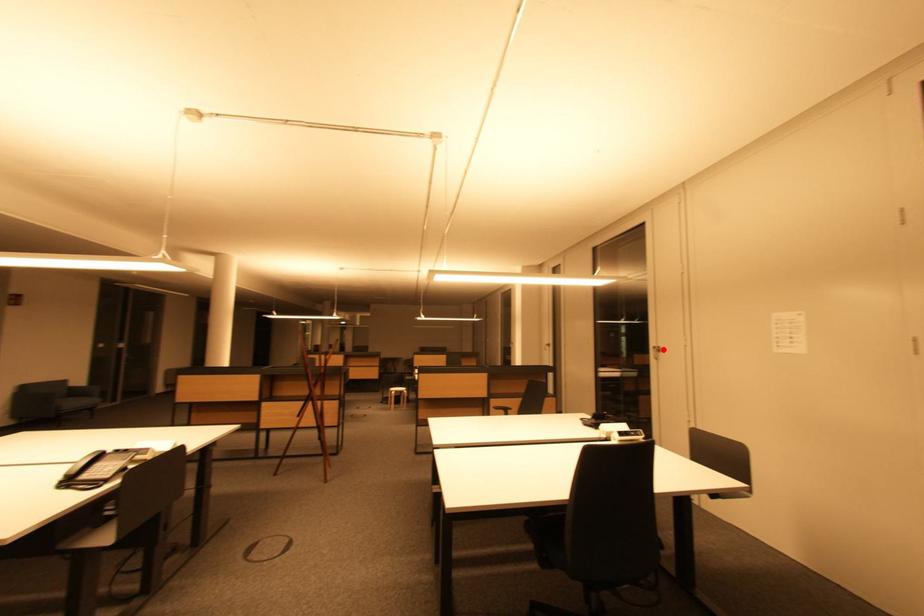
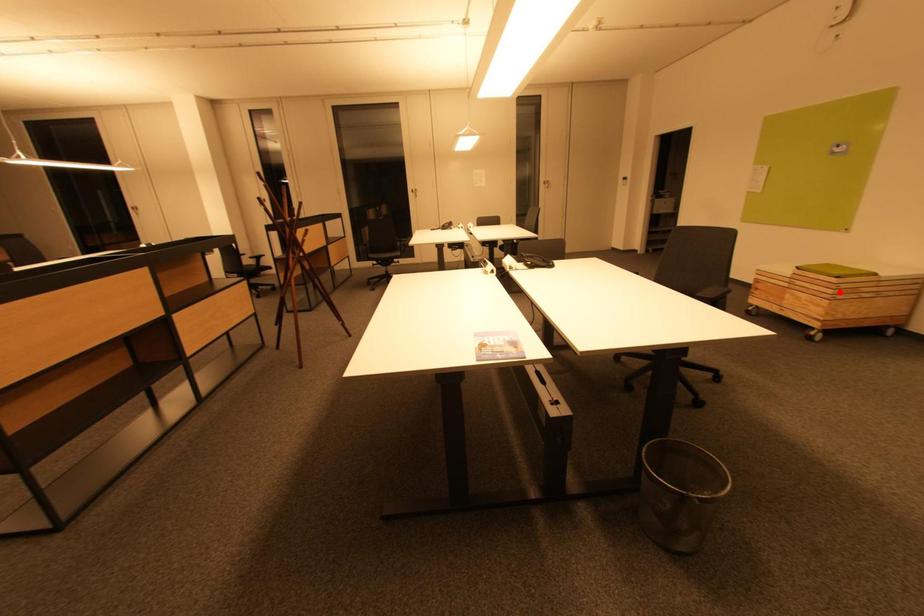
I am providing you with two images of the same scene from different viewpoints. A red point is marked on the first image and another point is marked on the second image. Does the point marked in image1 correspond to the same location as the one in image2?

No